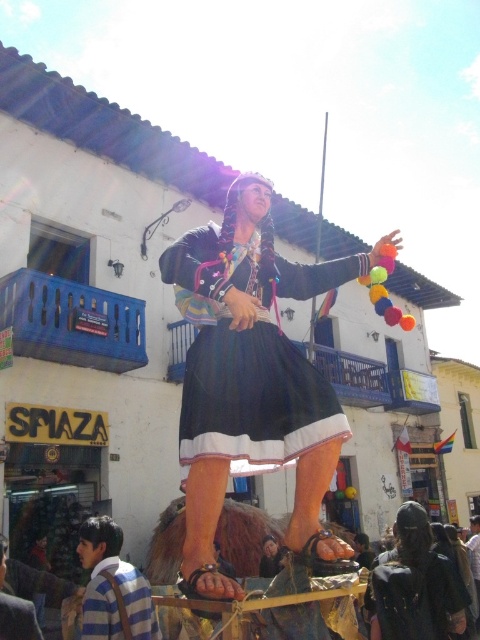
You are a fashion designer observing a street scene with a stilt walker. You notice two garments in the image. The first is the black satin dress at center, and the second is the striped cotton shirt at lower left. Which garment is smaller in size?

The black satin dress at center has a smaller size compared to the striped cotton shirt at lower left, so the black satin dress at center is the smaller garment.

You are a fashion designer observing a street festival and notice two outfits. The first is the black satin dress at center, and the second is the striped cotton shirt at lower left. Which outfit has a longer length?

The striped cotton shirt at lower left is longer than the black satin dress at center.